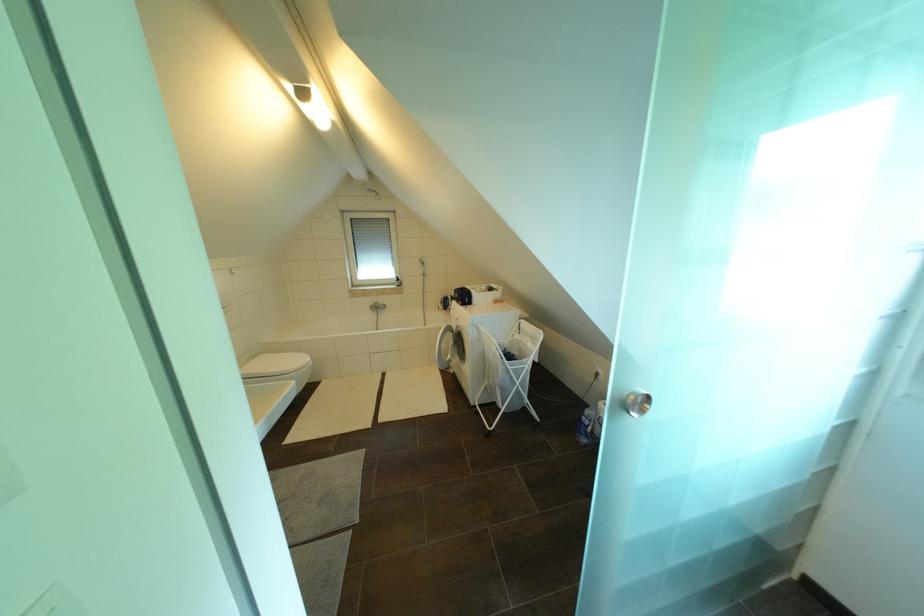
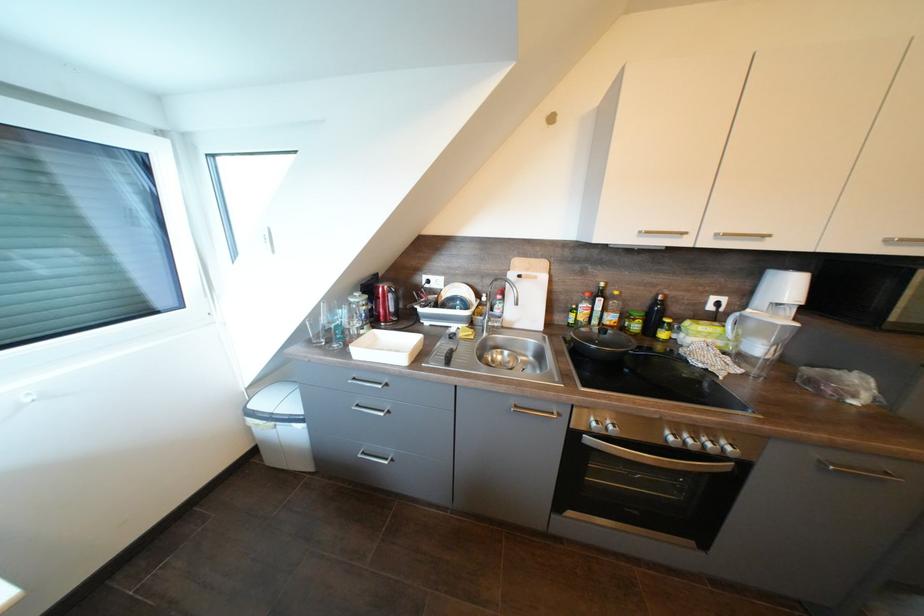
What movement of the cameraman would produce the second image?

The cameraman moved toward left, backward.